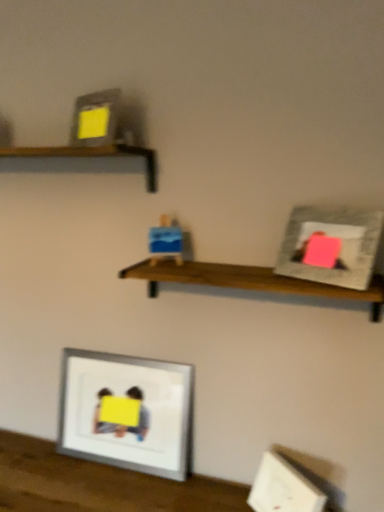
Question: Considering their positions, is blue cardboard box at center located in front of or behind silver metallic picture frame at lower center, acting as the first picture frame starting from the left?

Choices:
 (A) front
 (B) behind

Answer: (A)

Question: From a real-world perspective, is blue cardboard box at center positioned above or below silver metallic picture frame at lower center, which appears as the 1th picture frame when viewed from the back?

Choices:
 (A) above
 (B) below

Answer: (A)

Question: Which object is the farthest from the matte gray picture frame at upper right, the 2th picture frame when ordered from back to front?

Choices:
 (A) wooden shelf at center, which is the 2th shelf in top-to-bottom order
 (B) wooden shelf at upper left, the first shelf viewed from the top
 (C) silver metallic picture frame at lower center, acting as the 2th picture frame starting from the top
 (D) blue cardboard box at center

Answer: (C)

Question: Estimate the real-world distances between objects in this image. Which object is closer to the matte gray picture frame at upper right, placed as the 2th picture frame when sorted from left to right?

Choices:
 (A) silver metallic picture frame at lower center, which ranks as the second picture frame in right-to-left order
 (B) wooden shelf at upper left, the first shelf viewed from the top
 (C) blue cardboard box at center
 (D) wooden shelf at center, which is counted as the first shelf, starting from the right

Answer: (D)